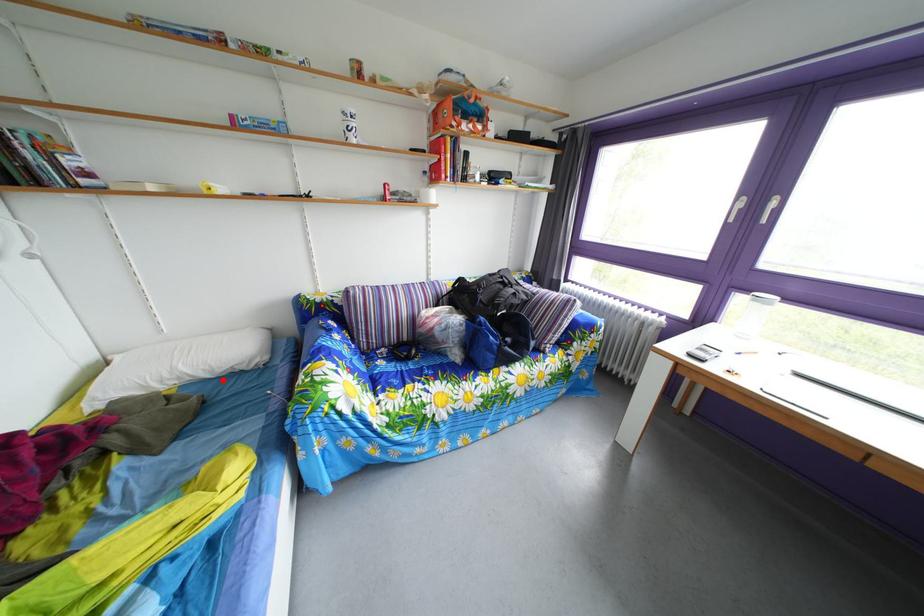
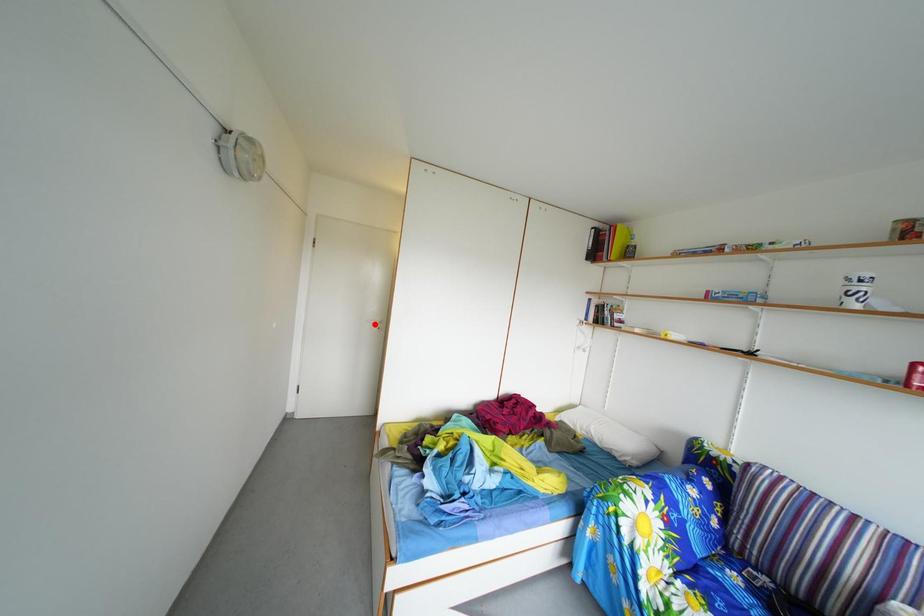
Consider the image. I am providing you with two images of the same scene from different viewpoints. A red point is marked on the first image and another point is marked on the second image. Is the red point in image1 aligned with the point shown in image2?

No